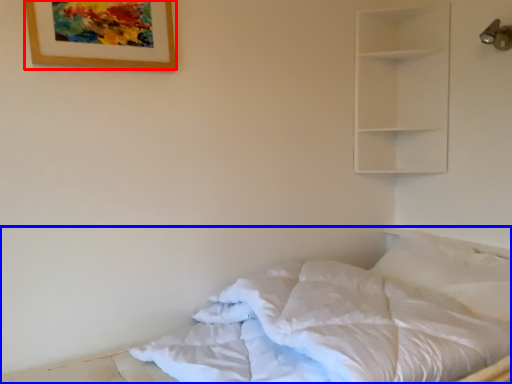
Question: Which object is further to the camera taking this photo, picture frame (highlighted by a red box) or bed (highlighted by a blue box)?

Choices:
 (A) picture frame
 (B) bed

Answer: (A)